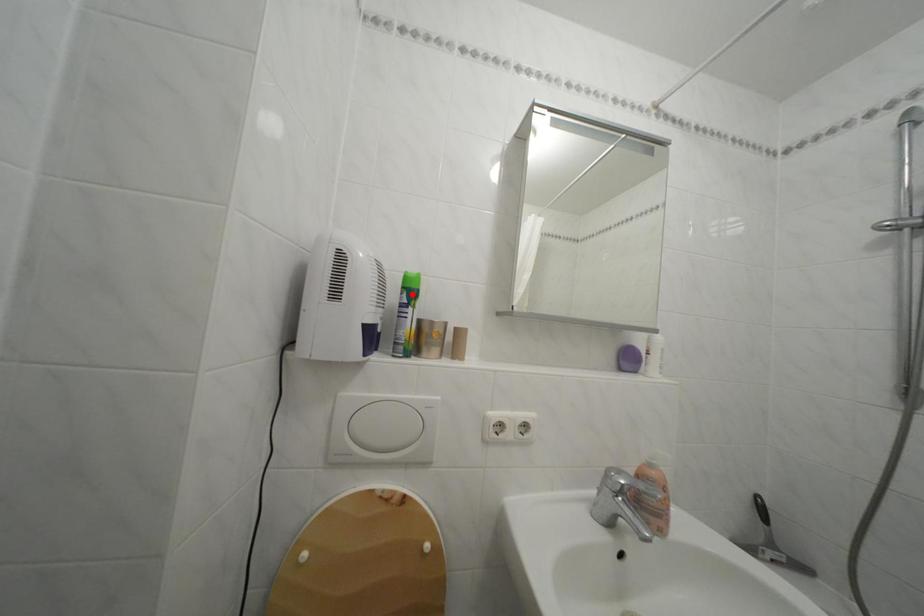
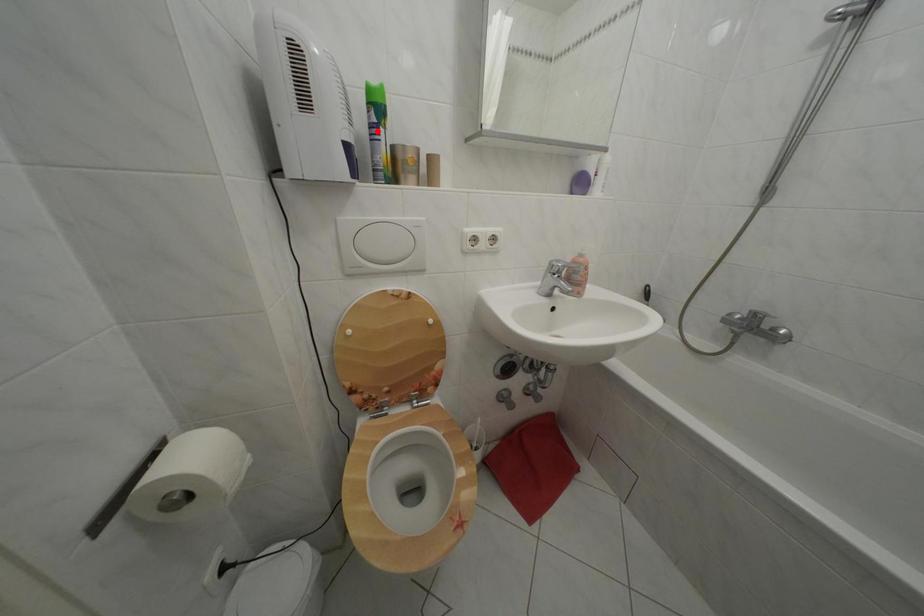
I am providing you with two images of the same scene from different viewpoints. A red point is marked on the first image and another point is marked on the second image. Is the marked point in image1 the same physical position as the marked point in image2?

No